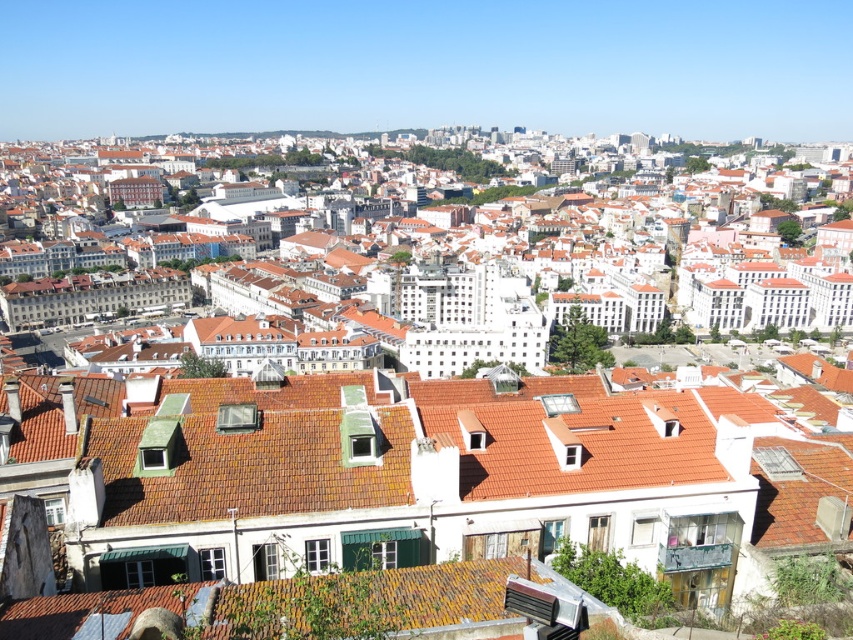
Looking at this image, you are standing in the foreground of the urban area and want to take a photo. There are two points of interest marked as point (361,401) and point (825,262). Which point will appear larger in your photo?

Point (361,401) is closer to the camera than point (825,262), so it will appear larger in the photo.

You are an architect analyzing the roof arrangement in this European city scene. Which of the two roofs, the brown tile roof at center or the orange tiled roofs at center, is positioned lower in the image?

The brown tile roof at center is positioned lower than the orange tiled roofs at center in the image.

You are standing in the urban area depicted in the image. You want to take a photo of the brown tile roof at center from where you are standing. Considering the distance, will you need a zoom lens to capture it clearly?

The brown tile roof at center is 71.53 meters away from the viewer. Since this distance is quite far, using a zoom lens would be necessary to capture it clearly.